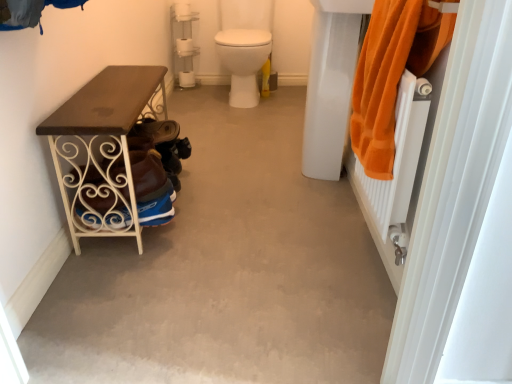
What are the coordinates of `vacant space in front of white glossy toilet at center` in the screenshot? It's located at (247, 117).